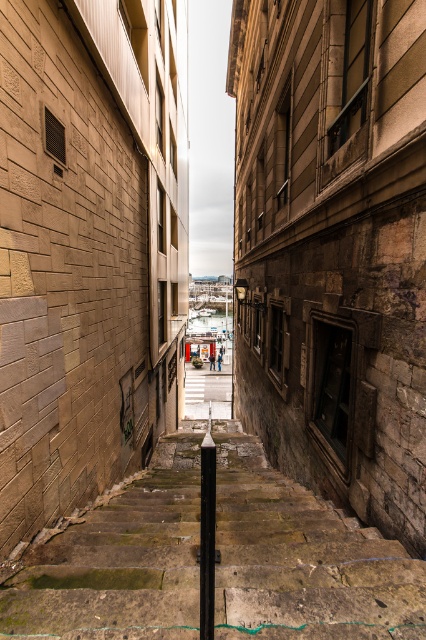
Which is more to the left, green mossy stone stairs at center or brick wall at center?

brick wall at center

Is green mossy stone stairs at center positioned in front of brick wall at center?

Yes.

Find the location of a particular element. green mossy stone stairs at center is located at coordinates (302, 560).